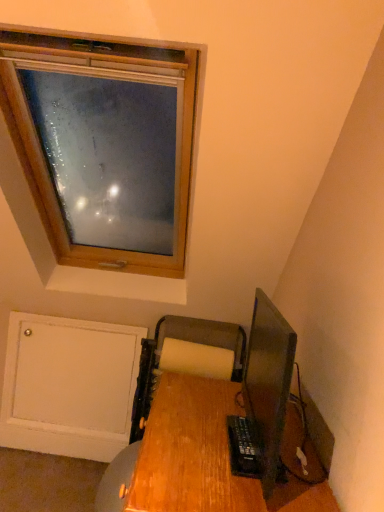
Locate an element on the screen. free region under matte black monitor at lower right (from a real-world perspective) is located at coordinates (238, 465).